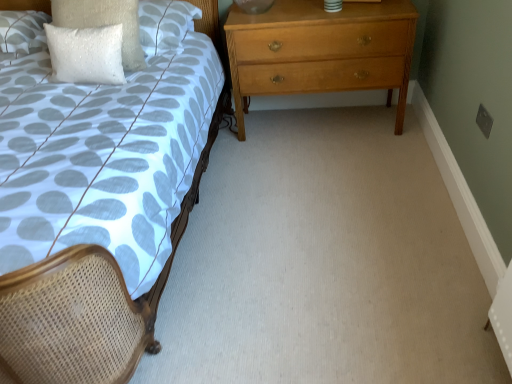
This screenshot has height=384, width=512. I want to click on white sequined pillow at upper left, placed as the 3th pillow when sorted from left to right, so click(x=104, y=23).

The image size is (512, 384). What do you see at coordinates (321, 50) in the screenshot?
I see `light brown wooden chest of drawers at right` at bounding box center [321, 50].

This screenshot has width=512, height=384. Describe the element at coordinates (86, 54) in the screenshot. I see `white sequined pillow at upper left, the 2th pillow positioned from the right` at that location.

What do you see at coordinates (23, 32) in the screenshot? The width and height of the screenshot is (512, 384). I see `white textured pillow at upper left, the third pillow viewed from the right` at bounding box center [23, 32].

This screenshot has height=384, width=512. What do you see at coordinates (83, 308) in the screenshot?
I see `matte woven bed at left` at bounding box center [83, 308].

Locate an element on the screen. The height and width of the screenshot is (384, 512). matte woven bed at left is located at coordinates (83, 308).

The width and height of the screenshot is (512, 384). Find the location of `white sequined pillow at upper left, placed as the 3th pillow when sorted from left to right`. white sequined pillow at upper left, placed as the 3th pillow when sorted from left to right is located at coordinates (104, 23).

Considering the points (0, 39) and (113, 9), which point is in front, point (0, 39) or point (113, 9)?

Point (113, 9)

From a real-world perspective, which object stands above the other?

From a 3D spatial view, white sequined pillow at upper left, the 1th pillow when ordered from right to left, is above.

Looking at this image, considering the relative sizes of white textured pillow at upper left, the third pillow viewed from the right, and white sequined pillow at upper left, the 1th pillow when ordered from right to left, in the image provided, is white textured pillow at upper left, the third pillow viewed from the right, taller than white sequined pillow at upper left, the 1th pillow when ordered from right to left,?

No.

Is white textured pillow at upper left, the 1th pillow viewed from the left, outside of white sequined pillow at upper left, placed as the 3th pillow when sorted from left to right?

white textured pillow at upper left, the 1th pillow viewed from the left, lies outside white sequined pillow at upper left, placed as the 3th pillow when sorted from left to right,'s area.

From a real-world perspective, who is located higher, light brown wooden chest of drawers at right or white sequined pillow at upper left, placed as the 3th pillow when sorted from left to right?

white sequined pillow at upper left, placed as the 3th pillow when sorted from left to right, is physically above.

Between light brown wooden chest of drawers at right and white sequined pillow at upper left, the 1th pillow when ordered from right to left, which one has more height?

light brown wooden chest of drawers at right.

Looking at this image, how far apart are light brown wooden chest of drawers at right and white sequined pillow at upper left, the 1th pillow when ordered from right to left?

The distance of light brown wooden chest of drawers at right from white sequined pillow at upper left, the 1th pillow when ordered from right to left, is 32.49 inches.

Find the location of a particular element. chest of drawers below the white sequined pillow at upper left, the 1th pillow when ordered from right to left (from a real-world perspective) is located at coordinates (321, 50).

Consider the image. Does white textured pillow at upper left, the third pillow viewed from the right, have a lesser height compared to matte woven bed at left?

Indeed, white textured pillow at upper left, the third pillow viewed from the right, has a lesser height compared to matte woven bed at left.

Which object is thinner, white textured pillow at upper left, the third pillow viewed from the right, or matte woven bed at left?

With smaller width is white textured pillow at upper left, the third pillow viewed from the right.

From a real-world perspective, between white textured pillow at upper left, the 1th pillow viewed from the left, and matte woven bed at left, who is vertically lower?

In real-world perspective, matte woven bed at left is lower.

Is white textured pillow at upper left, the 1th pillow viewed from the left, in front of or behind matte woven bed at left in the image?

white textured pillow at upper left, the 1th pillow viewed from the left, is behind matte woven bed at left.

Would you say matte woven bed at left is outside light brown wooden chest of drawers at right?

Yes, matte woven bed at left is not within light brown wooden chest of drawers at right.

Considering the sizes of objects matte woven bed at left and light brown wooden chest of drawers at right in the image provided, who is thinner, matte woven bed at left or light brown wooden chest of drawers at right?

With smaller width is light brown wooden chest of drawers at right.

From the image's perspective, which one is positioned lower, matte woven bed at left or light brown wooden chest of drawers at right?

matte woven bed at left.

Which object is more forward, matte woven bed at left or light brown wooden chest of drawers at right?

matte woven bed at left.

From a real-world perspective, starting from the white textured pillow at upper left, the 1th pillow viewed from the left, which pillow is the 1st one vertically above it? Please provide its 2D coordinates.

[(86, 54)]

Which object is further away from the camera taking this photo, white textured pillow at upper left, the 1th pillow viewed from the left, or white sequined pillow at upper left, arranged as the 2th pillow when viewed from the left?

Positioned behind is white textured pillow at upper left, the 1th pillow viewed from the left.

How far apart are white textured pillow at upper left, the third pillow viewed from the right, and white sequined pillow at upper left, the 2th pillow positioned from the right?

A distance of 20.46 inches exists between white textured pillow at upper left, the third pillow viewed from the right, and white sequined pillow at upper left, the 2th pillow positioned from the right.

Considering the sizes of objects white textured pillow at upper left, the third pillow viewed from the right, and white sequined pillow at upper left, the 2th pillow positioned from the right, in the image provided, who is taller, white textured pillow at upper left, the third pillow viewed from the right, or white sequined pillow at upper left, the 2th pillow positioned from the right,?

With more height is white sequined pillow at upper left, the 2th pillow positioned from the right.

Is point (82, 26) closer to viewer compared to point (118, 80)?

Yes, point (82, 26) is closer to viewer.

Which of these two, white sequined pillow at upper left, placed as the 3th pillow when sorted from left to right, or white sequined pillow at upper left, arranged as the 2th pillow when viewed from the left, is smaller?

With smaller size is white sequined pillow at upper left, arranged as the 2th pillow when viewed from the left.

From the image's perspective, would you say white sequined pillow at upper left, the 1th pillow when ordered from right to left, is shown under white sequined pillow at upper left, the 2th pillow positioned from the right?

Actually, white sequined pillow at upper left, the 1th pillow when ordered from right to left, appears above white sequined pillow at upper left, the 2th pillow positioned from the right, in the image.

Is the depth of white sequined pillow at upper left, the 1th pillow when ordered from right to left, greater than that of white sequined pillow at upper left, the 2th pillow positioned from the right?

That is True.

Could you tell me if white sequined pillow at upper left, arranged as the 2th pillow when viewed from the left, is turned towards white textured pillow at upper left, the third pillow viewed from the right?

No, white sequined pillow at upper left, arranged as the 2th pillow when viewed from the left, is not oriented towards white textured pillow at upper left, the third pillow viewed from the right.

Is point (72, 48) farther from viewer compared to point (24, 12)?

No, it is not.

Would you consider white sequined pillow at upper left, the 2th pillow positioned from the right, to be distant from white textured pillow at upper left, the 1th pillow viewed from the left?

No, white sequined pillow at upper left, the 2th pillow positioned from the right, is in close proximity to white textured pillow at upper left, the 1th pillow viewed from the left.

Is white sequined pillow at upper left, the 2th pillow positioned from the right, bigger or smaller than white textured pillow at upper left, the third pillow viewed from the right?

white sequined pillow at upper left, the 2th pillow positioned from the right, is smaller than white textured pillow at upper left, the third pillow viewed from the right.

I want to click on the 1st pillow in front of the white textured pillow at upper left, the 1th pillow viewed from the left, counting from the anchor's position, so click(x=104, y=23).

Locate an element on the screen. This screenshot has width=512, height=384. the chest of drawers lying below the white sequined pillow at upper left, placed as the 3th pillow when sorted from left to right (from the image's perspective) is located at coordinates (321, 50).

Looking at the image, which one is located closer to white sequined pillow at upper left, placed as the 3th pillow when sorted from left to right, white sequined pillow at upper left, arranged as the 2th pillow when viewed from the left, or matte woven bed at left?

white sequined pillow at upper left, arranged as the 2th pillow when viewed from the left, is positioned closer to the anchor white sequined pillow at upper left, placed as the 3th pillow when sorted from left to right.

Considering their positions, is light brown wooden chest of drawers at right positioned further to matte woven bed at left than white textured pillow at upper left, the 1th pillow viewed from the left?

white textured pillow at upper left, the 1th pillow viewed from the left, is further to matte woven bed at left.

Based on their spatial positions, is white sequined pillow at upper left, arranged as the 2th pillow when viewed from the left, or matte woven bed at left closer to light brown wooden chest of drawers at right?

white sequined pillow at upper left, arranged as the 2th pillow when viewed from the left, is closer to light brown wooden chest of drawers at right.

Based on their spatial positions, is light brown wooden chest of drawers at right or white textured pillow at upper left, the third pillow viewed from the right, closer to white sequined pillow at upper left, arranged as the 2th pillow when viewed from the left?

white textured pillow at upper left, the third pillow viewed from the right, is positioned closer to the anchor white sequined pillow at upper left, arranged as the 2th pillow when viewed from the left.

Based on their spatial positions, is light brown wooden chest of drawers at right or white sequined pillow at upper left, the 2th pillow positioned from the right, closer to white sequined pillow at upper left, the 1th pillow when ordered from right to left?

The object closer to white sequined pillow at upper left, the 1th pillow when ordered from right to left, is white sequined pillow at upper left, the 2th pillow positioned from the right.

From the image, which object appears to be nearer to white sequined pillow at upper left, arranged as the 2th pillow when viewed from the left, white textured pillow at upper left, the third pillow viewed from the right, or matte woven bed at left?

white textured pillow at upper left, the third pillow viewed from the right, is positioned closer to the anchor white sequined pillow at upper left, arranged as the 2th pillow when viewed from the left.

Considering their positions, is matte woven bed at left positioned closer to white sequined pillow at upper left, placed as the 3th pillow when sorted from left to right, than white textured pillow at upper left, the third pillow viewed from the right?

white textured pillow at upper left, the third pillow viewed from the right.

Considering their positions, is white sequined pillow at upper left, the 2th pillow positioned from the right, positioned closer to matte woven bed at left than white textured pillow at upper left, the 1th pillow viewed from the left?

The object closer to matte woven bed at left is white sequined pillow at upper left, the 2th pillow positioned from the right.

Locate an element on the screen. The width and height of the screenshot is (512, 384). pillow situated between white sequined pillow at upper left, arranged as the 2th pillow when viewed from the left, and light brown wooden chest of drawers at right from left to right is located at coordinates (104, 23).

I want to click on pillow between matte woven bed at left and white sequined pillow at upper left, the 1th pillow when ordered from right to left, in the front-back direction, so click(86, 54).

At what (x,y) coordinates should I click in order to perform the action: click on pillow between white textured pillow at upper left, the third pillow viewed from the right, and white sequined pillow at upper left, placed as the 3th pillow when sorted from left to right, in the horizontal direction. Please return your answer as a coordinate pair (x, y). Looking at the image, I should click on (86, 54).

At what (x,y) coordinates should I click in order to perform the action: click on bed between white textured pillow at upper left, the 1th pillow viewed from the left, and light brown wooden chest of drawers at right from left to right. Please return your answer as a coordinate pair (x, y). The height and width of the screenshot is (384, 512). Looking at the image, I should click on tap(83, 308).